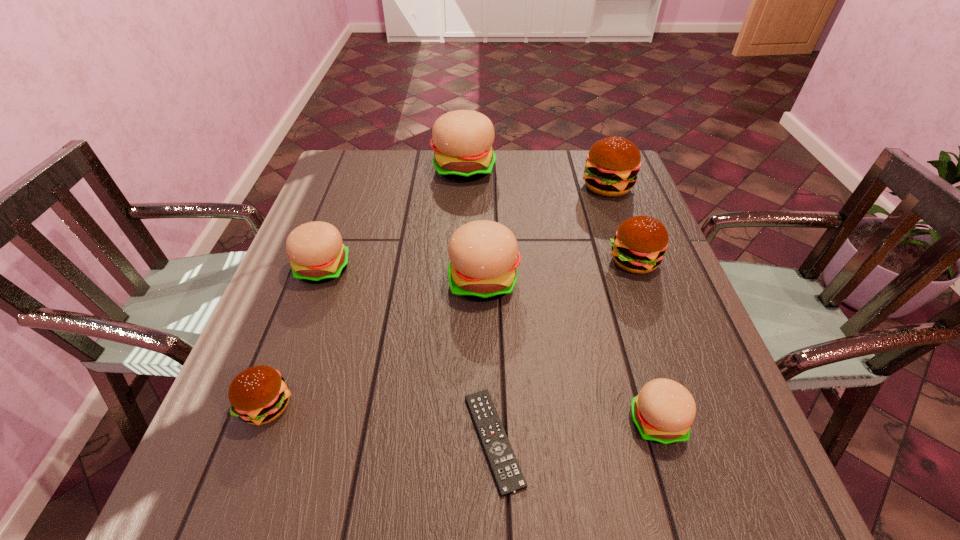
Point out which brown hamburger is positioned as the nearest to the remote control. Please provide its 2D coordinates. Your answer should be formatted as a tuple, i.e. [(x, y)], where the tuple contains the x and y coordinates of a point satisfying the conditions above.

[(258, 395)]